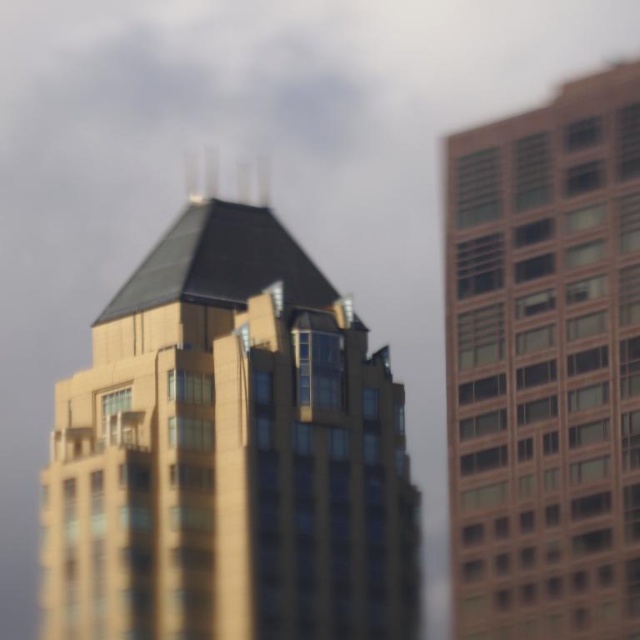
You are an architect evaluating the cityscape. Given that the gold glass building at center and the brown brick building at right are both visible from your vantage point, which building would cast a longer shadow during midday? Explain your reasoning based on their sizes and positions.

The gold glass building at center has a larger size compared to the brown brick building at right. Since larger buildings typically cast longer shadows when the sun is at the same angle, the gold glass building at center would cast a longer shadow during midday.

Consider the image. You are an architect evaluating the city skyline. Based on the image, which building, the gold glass building at center or the brown brick building at right, would cast a longer shadow during midday when the sun is directly overhead?

The gold glass building at center is taller than the brown brick building at right, so it would cast a longer shadow during midday when the sun is directly overhead.